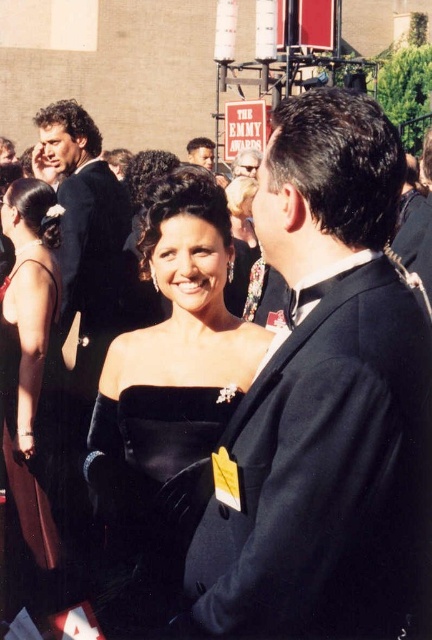
You are a photographer at the Emmy Awards event. You need to capture a photo of both the black satin dress at center and the brown satin dress at left. Which dress is lower in the frame?

The black satin dress at center is positioned under the brown satin dress at left, so it is lower in the frame.

You are a photographer at the Emmy Awards event. You need to capture a photo of the velvet black dress at center and the dark brown hair at center. Which object should you focus on first if you want to prioritize the one closer to the camera?

The velvet black dress at center has a lesser height compared to dark brown hair at center, so the velvet black dress at center is closer to the camera. Therefore, you should focus on the velvet black dress at center first.

In the scene shown: You are a photographer at the Emmy Awards event. You need to capture a photo of the velvet black dress at center and the dark brown hair at center. Which object should you focus on first to ensure both are in sharp focus?

The velvet black dress at center is closer to the viewer than dark brown hair at center. To ensure both are in sharp focus, you should focus on the velvet black dress at center first, as it is the closer object.